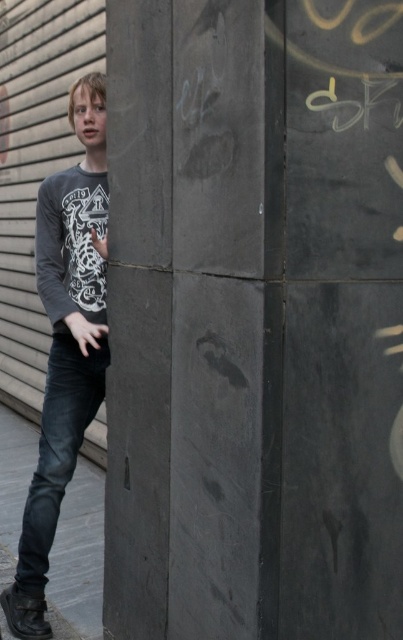
You are a fashion designer observing the scene. You notice the dark gray cotton shirt at left and the black denim jeans at lower left. Which clothing item appears higher in the image?

The dark gray cotton shirt at left appears higher in the image because it is taller than the black denim jeans at lower left.

You are a photographer trying to capture the dark gray cotton shirt at left. Based on the coordinates point (66, 342), where should you position your camera to ensure the shirt is in the frame?

The dark gray cotton shirt at left is represented by point (66, 342), so position the camera so that this coordinate is within the frame to capture the shirt.

You are a fashion designer analyzing clothing items in an urban setting. You notice the dark gray cotton shirt at left and the black denim jeans at lower left. Which clothing item is positioned more to the right side of the image?

The dark gray cotton shirt at left is positioned more to the right side of the image compared to the black denim jeans at lower left.